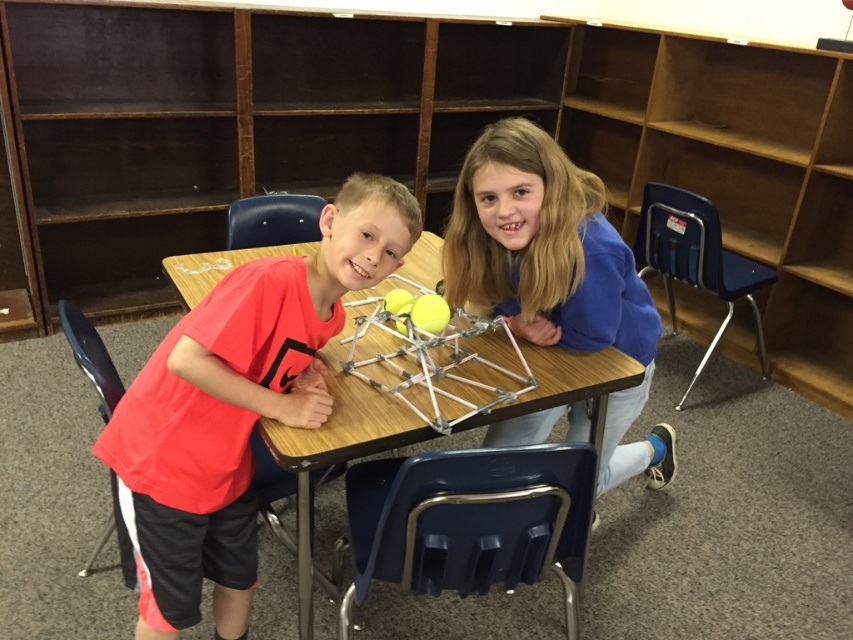
Who is positioned more to the right, red matte shirt at center or blue fleece jacket at upper center?

Positioned to the right is blue fleece jacket at upper center.

Between red matte shirt at center and blue fleece jacket at upper center, which one is positioned lower?

red matte shirt at center is below.

Image resolution: width=853 pixels, height=640 pixels. Identify the location of red matte shirt at center. (236, 404).

Does wooden bookshelf at upper center have a greater width compared to blue fleece jacket at upper center?

Indeed, wooden bookshelf at upper center has a greater width compared to blue fleece jacket at upper center.

Does wooden bookshelf at upper center appear over blue fleece jacket at upper center?

Yes, wooden bookshelf at upper center is above blue fleece jacket at upper center.

Where is `wooden bookshelf at upper center`? The width and height of the screenshot is (853, 640). wooden bookshelf at upper center is located at coordinates (415, 138).

Is point (328, 93) farther from camera compared to point (619, 369)?

Yes, point (328, 93) is behind point (619, 369).

Is wooden bookshelf at upper center closer to the viewer compared to wooden table at center?

No.

Between point (393, 163) and point (370, 424), which one is positioned behind?

The point (393, 163) is more distant.

This screenshot has width=853, height=640. I want to click on wooden bookshelf at upper center, so click(415, 138).